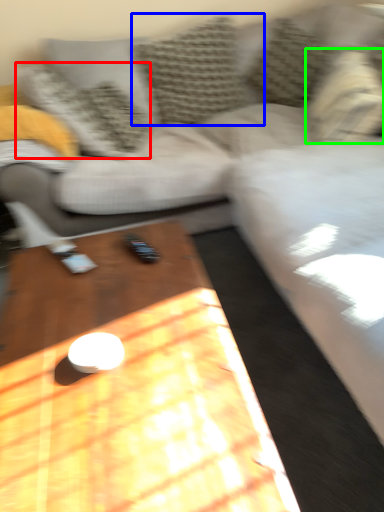
Question: Based on their relative distances, which object is farther from pillow (highlighted by a red box)? Choose from pillow (highlighted by a blue box) and pillow (highlighted by a green box).

Choices:
 (A) pillow
 (B) pillow

Answer: (B)